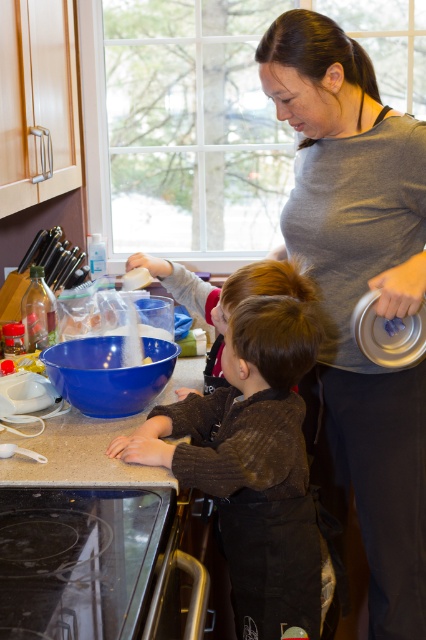
Does gray matte shirt at upper center have a larger size compared to smooth granite countertop at lower center?

Indeed, gray matte shirt at upper center has a larger size compared to smooth granite countertop at lower center.

Does gray matte shirt at upper center appear under smooth granite countertop at lower center?

No.

Between point (359, 440) and point (13, 468), which one is positioned in front?

Point (13, 468) is in front.

Identify the location of gray matte shirt at upper center. (357, 292).

Measure the distance between point (380, 298) and camera.

1.31 meters

Does point (380, 634) come farther from viewer compared to point (241, 625)?

Yes, point (380, 634) is farther from viewer.

Identify the location of gray matte shirt at upper center. (357, 292).

I want to click on gray matte shirt at upper center, so click(357, 292).

Can you confirm if smooth granite countertop at lower center is bigger than smooth brown hair at center?

Incorrect, smooth granite countertop at lower center is not larger than smooth brown hair at center.

From the picture: Does smooth granite countertop at lower center lie behind smooth brown hair at center?

No, smooth granite countertop at lower center is in front of smooth brown hair at center.

Is point (97, 433) farther from camera compared to point (226, 280)?

Yes.

At what (x,y) coordinates should I click in order to perform the action: click on smooth granite countertop at lower center. Please return your answer as a coordinate pair (x, y). Looking at the image, I should click on (92, 444).